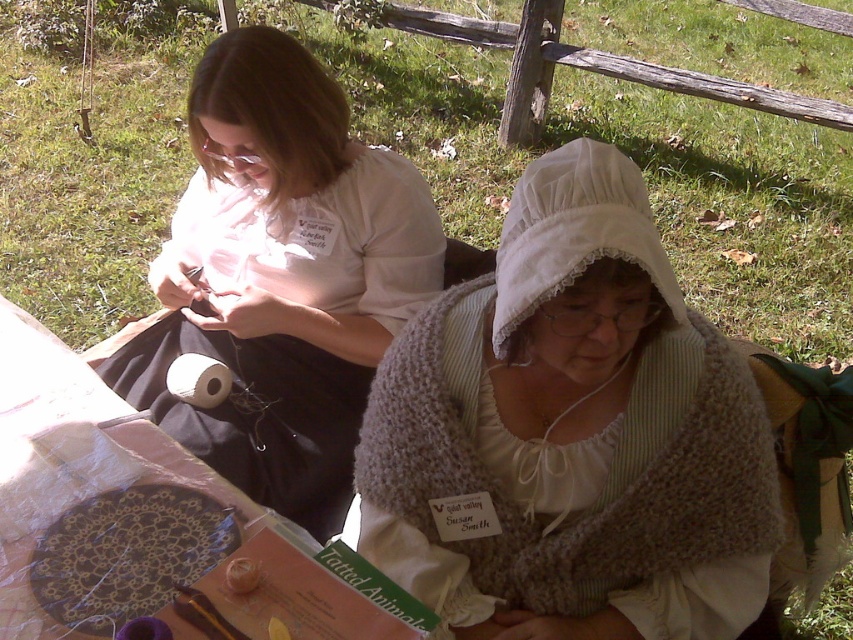
Question: Is white knit shawl at center below matte white shirt at upper left?

Choices:
 (A) no
 (B) yes

Answer: (B)

Question: Observing the image, what is the correct spatial positioning of white knit shawl at center in reference to matte white shirt at upper left?

Choices:
 (A) below
 (B) above

Answer: (A)

Question: Which point appears farthest from the camera in this image?

Choices:
 (A) (560, 388)
 (B) (259, 397)

Answer: (B)

Question: Can you confirm if white knit shawl at center is positioned below matte white shirt at upper left?

Choices:
 (A) yes
 (B) no

Answer: (A)